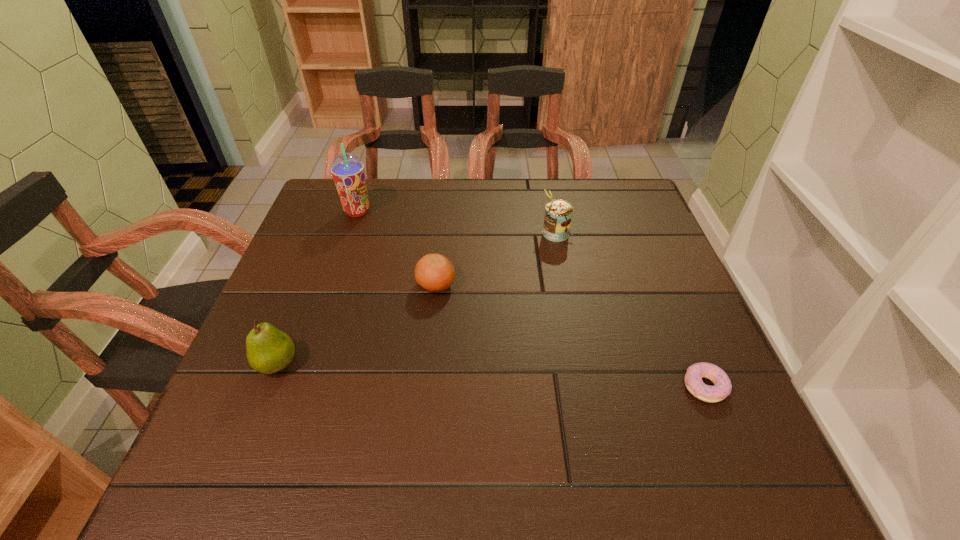
This screenshot has width=960, height=540. What are the coordinates of `vacant space at the far edge of the desktop` in the screenshot? It's located at pos(484,201).

What are the coordinates of `blank space at the near edge` in the screenshot? It's located at (371, 456).

This screenshot has height=540, width=960. In the image, there is a desktop. What are the coordinates of `free space at the left edge` in the screenshot? It's located at (284, 374).

In order to click on vacant space at the right edge of the desktop in this screenshot , I will do `click(666, 268)`.

Image resolution: width=960 pixels, height=540 pixels. I want to click on free region at the far right corner of the desktop, so click(602, 197).

Find the location of a particular element. free space that is in between the third farthest object and the fourth nearest object is located at coordinates (495, 259).

In order to click on free space between the third nearest object and the fourth nearest object in this screenshot , I will do `click(495, 259)`.

Identify the location of vacant space that is in between the smoothie and the shortest object. (531, 299).

Find the location of a particular element. This screenshot has height=540, width=960. vacant space that's between the farthest object and the second object from right to left is located at coordinates (457, 222).

The height and width of the screenshot is (540, 960). Find the location of `free space between the shortest object and the farthest object`. free space between the shortest object and the farthest object is located at coordinates (531, 299).